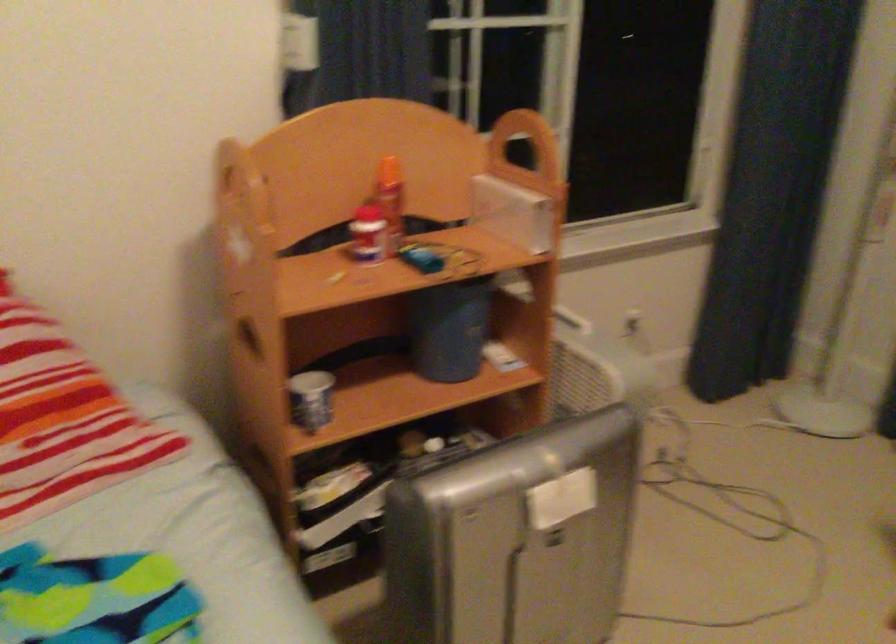
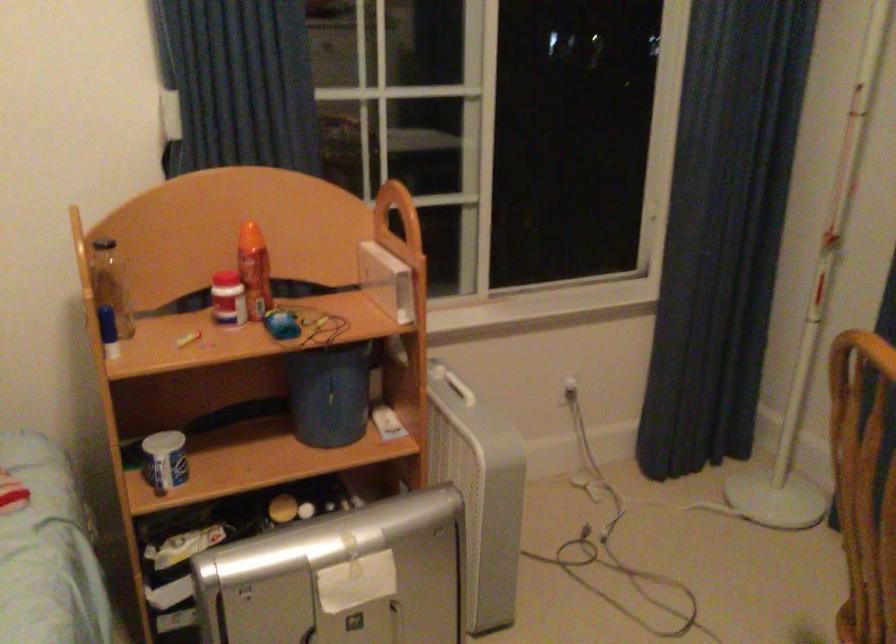
In the second image, find the point that corresponds to the point at 460,328 in the first image.

(331, 395)